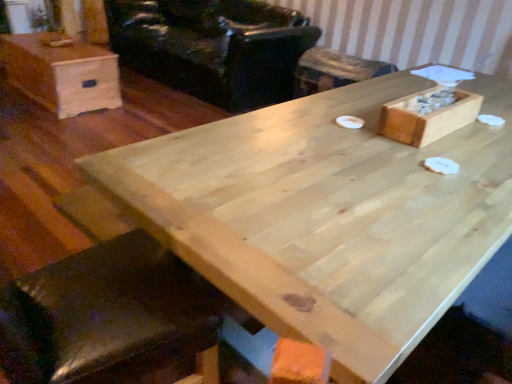
Question: Considering the relative sizes of light brown wood box at upper left and black leather armchair at upper center in the image provided, is light brown wood box at upper left wider than black leather armchair at upper center?

Choices:
 (A) no
 (B) yes

Answer: (A)

Question: Is light brown wood box at upper left thinner than black leather armchair at upper center?

Choices:
 (A) yes
 (B) no

Answer: (A)

Question: Is light brown wood box at upper left further to camera compared to black leather armchair at upper center?

Choices:
 (A) no
 (B) yes

Answer: (A)

Question: Is light brown wood box at upper left aimed at black leather armchair at upper center?

Choices:
 (A) no
 (B) yes

Answer: (A)

Question: From a real-world perspective, is light brown wood box at upper left under black leather armchair at upper center?

Choices:
 (A) no
 (B) yes

Answer: (B)

Question: Is black leather armchair at upper center at the back of light brown wood box at upper left?

Choices:
 (A) yes
 (B) no

Answer: (A)

Question: Is light brown wood box at upper left to the right of natural wood table at center from the viewer's perspective?

Choices:
 (A) yes
 (B) no

Answer: (B)

Question: From a real-world perspective, is light brown wood box at upper left on natural wood table at center?

Choices:
 (A) yes
 (B) no

Answer: (B)

Question: Is light brown wood box at upper left outside of natural wood table at center?

Choices:
 (A) yes
 (B) no

Answer: (A)

Question: Does light brown wood box at upper left lie in front of natural wood table at center?

Choices:
 (A) yes
 (B) no

Answer: (B)

Question: Is light brown wood box at upper left wider than natural wood table at center?

Choices:
 (A) no
 (B) yes

Answer: (A)

Question: Considering the relative sizes of light brown wood box at upper left and natural wood table at center in the image provided, is light brown wood box at upper left shorter than natural wood table at center?

Choices:
 (A) yes
 (B) no

Answer: (A)

Question: Considering the relative positions of black leather armchair at upper center and natural wood table at center in the image provided, is black leather armchair at upper center in front of natural wood table at center?

Choices:
 (A) no
 (B) yes

Answer: (A)